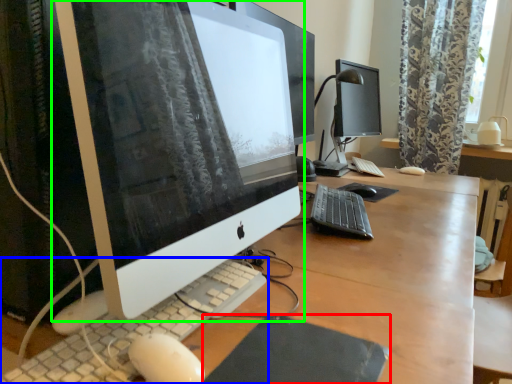
Question: Considering the real-world distances, which object is closest to mousepad (highlighted by a red box)? computer keyboard (highlighted by a blue box) or computer monitor (highlighted by a green box).

Choices:
 (A) computer keyboard
 (B) computer monitor

Answer: (A)